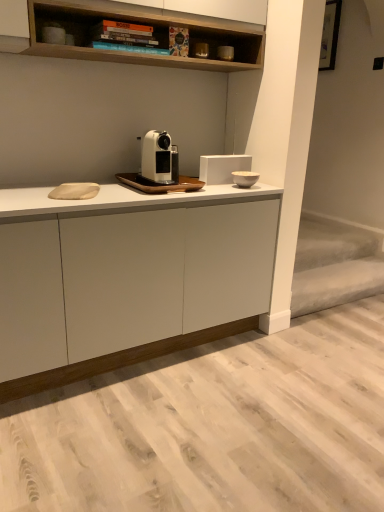
Question: Which is correct: white ceramic bowl at upper right, placed as the 1th appliance when sorted from bottom to top, is inside white matte coffee machine at center, or outside of it?

Choices:
 (A) inside
 (B) outside

Answer: (B)

Question: Based on their sizes in the image, would you say white ceramic bowl at upper right, placed as the 1th appliance when sorted from bottom to top, is bigger or smaller than white matte coffee machine at center?

Choices:
 (A) big
 (B) small

Answer: (B)

Question: Which of these objects is positioned closest to the matte black coffee machine at upper center, which is the second appliance from bottom to top?

Choices:
 (A) white ceramic bowl at upper right, which is counted as the second appliance, starting from the top
 (B) white matte coffee machine at center
 (C) white matte cabinet at center

Answer: (A)

Question: Which is nearer to the white ceramic bowl at upper right, placed as the 1th appliance when sorted from bottom to top?

Choices:
 (A) matte black coffee machine at upper center, the first appliance viewed from the top
 (B) white matte cabinet at center
 (C) white matte coffee machine at center

Answer: (C)